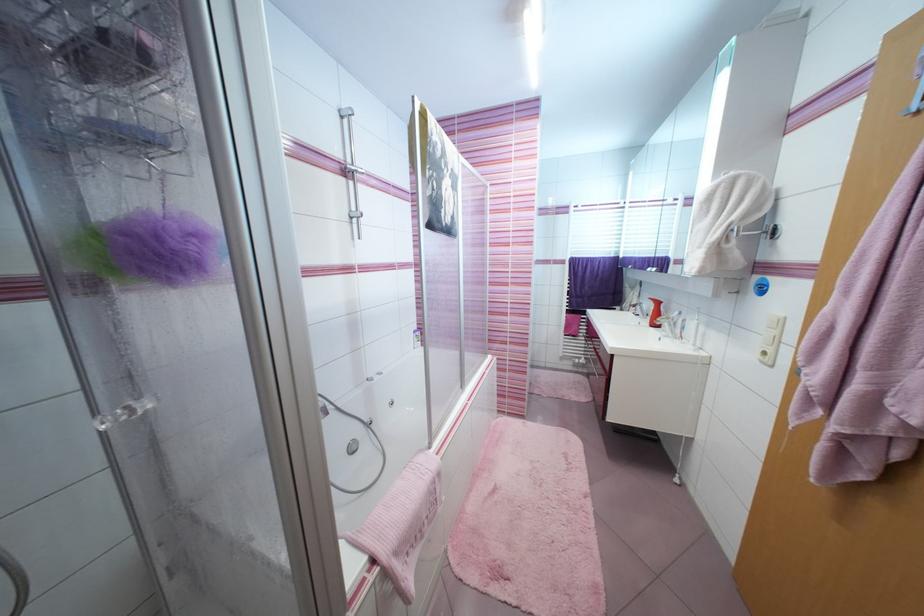
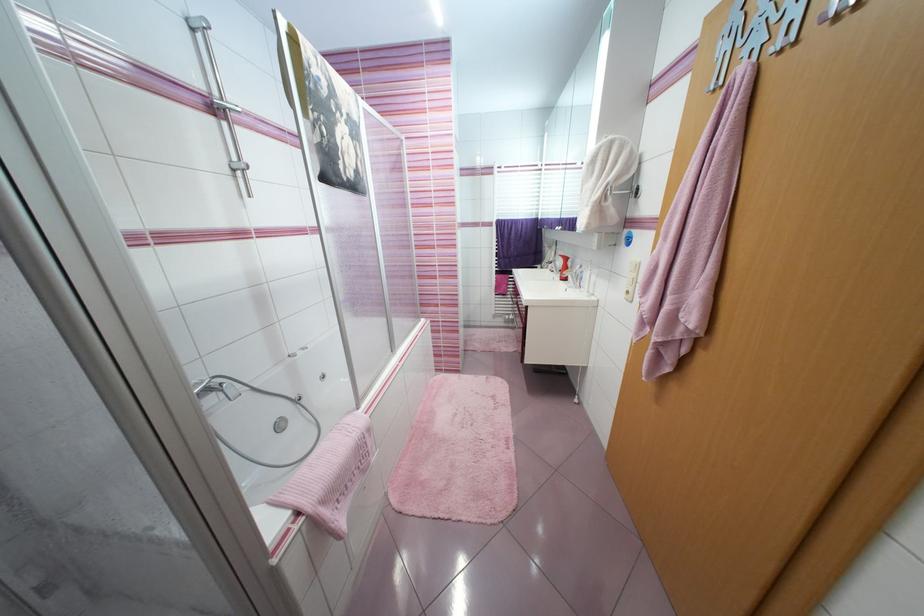
In the second image, find the point that corresponds to point (365, 216) in the first image.

(249, 167)